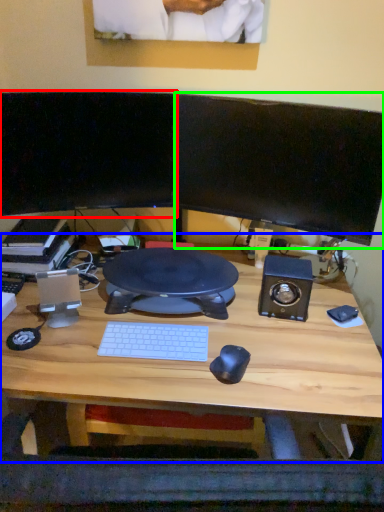
Question: Which object is the farthest from computer monitor (highlighted by a red box)? Choose among these: desk (highlighted by a blue box) or computer monitor (highlighted by a green box).

Choices:
 (A) desk
 (B) computer monitor

Answer: (A)